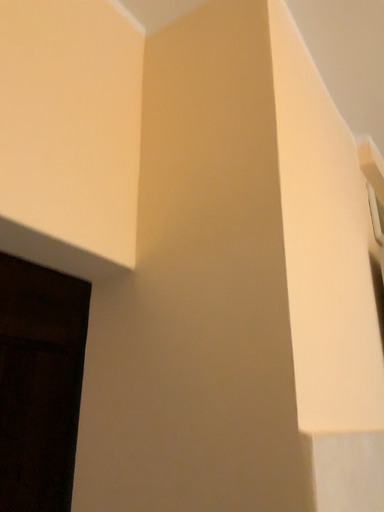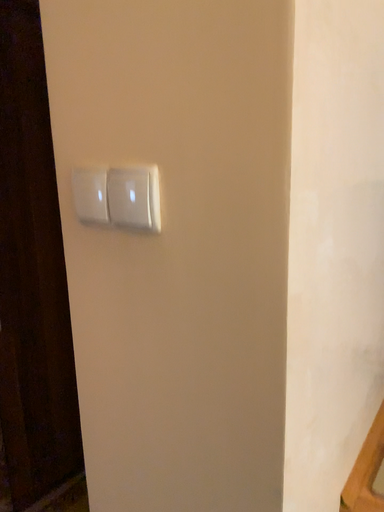
Question: How did the camera likely rotate when shooting the video?

Choices:
 (A) rotated upward
 (B) rotated downward

Answer: (B)